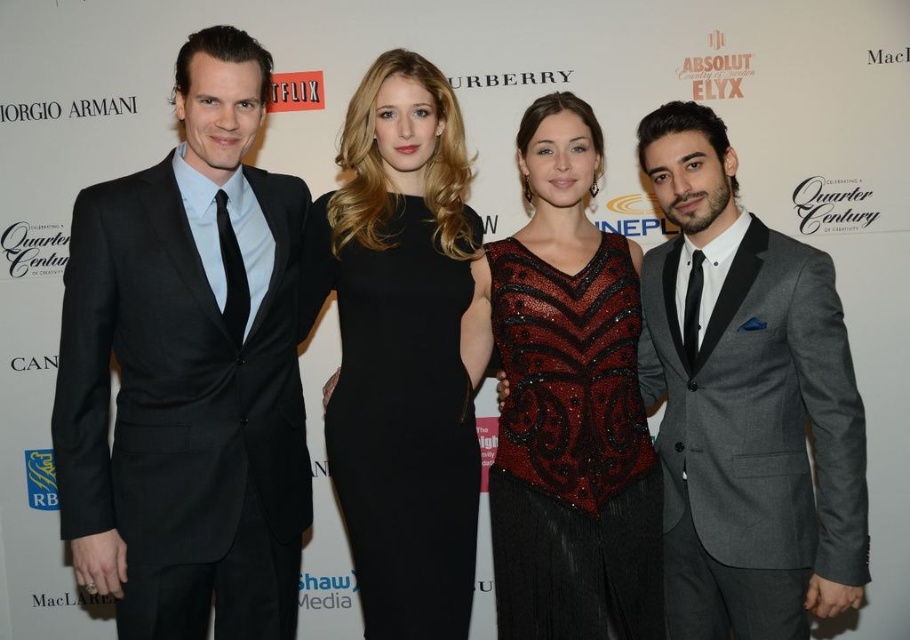
You are a photographer at the event and need to adjust the lighting to ensure both the black satin suit at left and the black satin dress at center are equally visible. Given their sizes, which one might require more focused lighting to avoid being overshadowed?

The black satin suit at left is bigger than the black satin dress at center, so the dress might require more focused lighting to ensure it is equally visible compared to the larger suit.

You are a photographer at the event and need to adjust the lighting so that both the black satin suit at left and the black satin dress at center are evenly lit. The camera you are using has a maximum effective range of 30 centimeters. Can you light both subjects without moving your position?

The distance between the black satin suit at left and the black satin dress at center is 31.69 centimeters, which exceeds the camera system maximum effective range of 30 centimeters. Therefore, you will need to move closer to ensure both subjects are within the 30 cm range for even lighting.